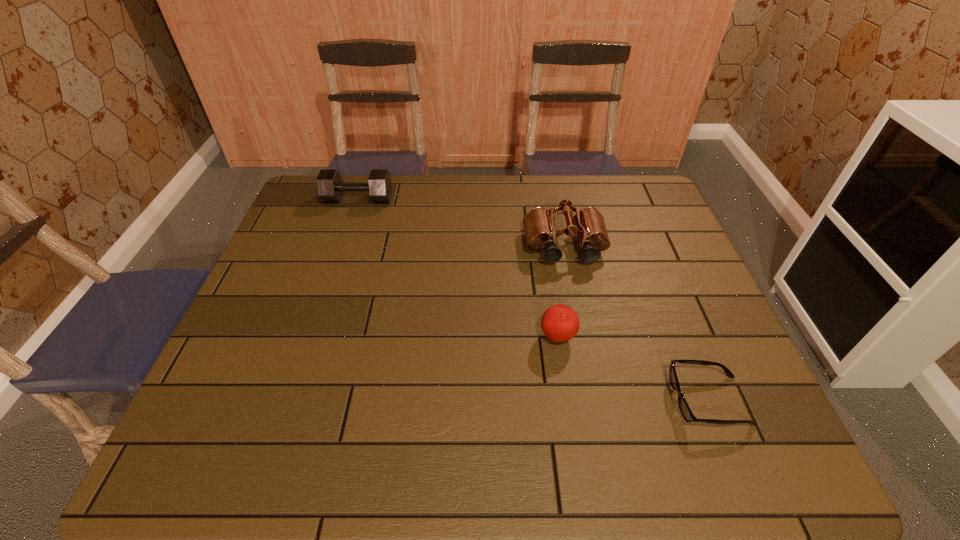
Find the location of a particular element. This screenshot has height=540, width=960. the third nearest object is located at coordinates (588, 224).

Image resolution: width=960 pixels, height=540 pixels. What are the coordinates of `the tallest object` in the screenshot? It's located at (588, 224).

This screenshot has width=960, height=540. Find the location of `the leftmost object`. the leftmost object is located at coordinates (330, 187).

Find the location of a particular element. Image resolution: width=960 pixels, height=540 pixels. dumbbell is located at coordinates (330, 187).

Locate an element on the screen. This screenshot has height=540, width=960. apple is located at coordinates (560, 323).

Image resolution: width=960 pixels, height=540 pixels. In order to click on the rightmost object in this screenshot , I will do `click(684, 408)`.

In order to click on spectacles in this screenshot , I will do `click(684, 408)`.

Where is `vacant space situated through the eyepieces of the binoculars`? Image resolution: width=960 pixels, height=540 pixels. vacant space situated through the eyepieces of the binoculars is located at coordinates (589, 369).

In order to click on free space located 0.070m on the right of the leftmost object in this screenshot , I will do `click(412, 199)`.

Where is `free location located 0.050m on the left of the third farthest object`? Image resolution: width=960 pixels, height=540 pixels. free location located 0.050m on the left of the third farthest object is located at coordinates (518, 337).